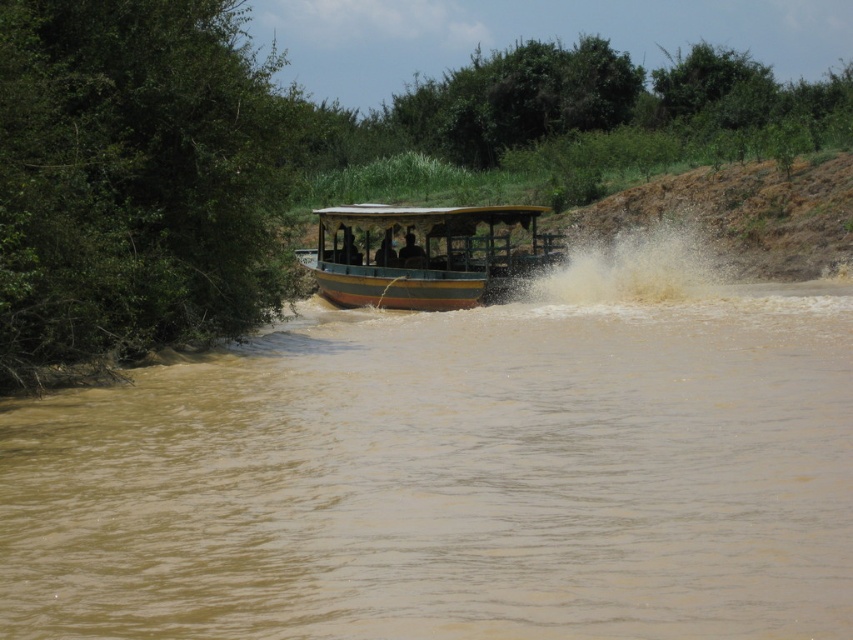
Is brown muddy water at center taller than dark brown wooden boat at center?

Yes.

Is brown muddy water at center to the right of dark brown wooden boat at center from the viewer's perspective?

Correct, you'll find brown muddy water at center to the right of dark brown wooden boat at center.

Is point (138, 381) positioned before point (410, 259)?

Yes, point (138, 381) is closer to viewer.

Locate an element on the screen. The image size is (853, 640). brown muddy water at center is located at coordinates (451, 481).

Is brown muddy water at center below wooden boat at center?

Yes.

Is brown muddy water at center to the right of wooden boat at center from the viewer's perspective?

Indeed, brown muddy water at center is positioned on the right side of wooden boat at center.

Does point (680, 554) come behind point (322, 273)?

No, (680, 554) is in front of (322, 273).

Where is `brown muddy water at center`? This screenshot has width=853, height=640. brown muddy water at center is located at coordinates (451, 481).

Can you confirm if wooden boat at center is positioned to the left of dark brown wooden boat at center?

No, wooden boat at center is not to the left of dark brown wooden boat at center.

Between point (368, 291) and point (415, 268), which one is positioned behind?

Positioned behind is point (415, 268).

Is point (451, 278) closer to viewer compared to point (410, 266)?

Yes, it is in front of point (410, 266).

Find the location of a particular element. The image size is (853, 640). wooden boat at center is located at coordinates (425, 253).